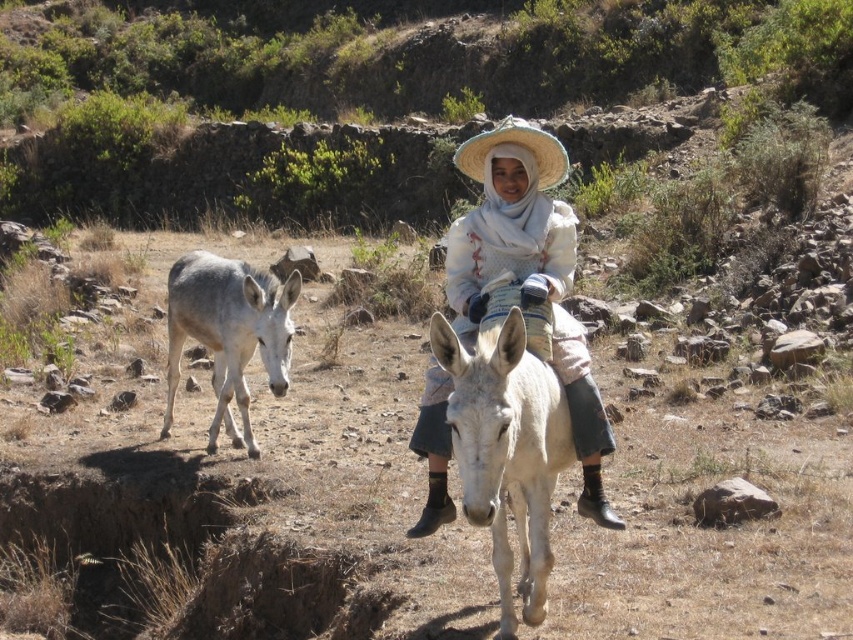
Question: Can you confirm if white matte donkey at center is smaller than white matte donkey at left?

Choices:
 (A) yes
 (B) no

Answer: (A)

Question: Among these points, which one is nearest to the camera?

Choices:
 (A) (502, 561)
 (B) (463, 161)
 (C) (213, 337)

Answer: (A)

Question: Does white cotton dress at center have a smaller size compared to natural straw hat at center?

Choices:
 (A) no
 (B) yes

Answer: (B)

Question: Is white cotton dress at center in front of white matte donkey at center?

Choices:
 (A) yes
 (B) no

Answer: (B)

Question: Which of the following is the farthest from the observer?

Choices:
 (A) white cotton dress at center
 (B) white matte donkey at left
 (C) natural straw hat at center
 (D) white matte donkey at center

Answer: (B)

Question: Which of the following is the closest to the observer?

Choices:
 (A) natural straw hat at center
 (B) white matte donkey at left
 (C) white matte donkey at center

Answer: (C)